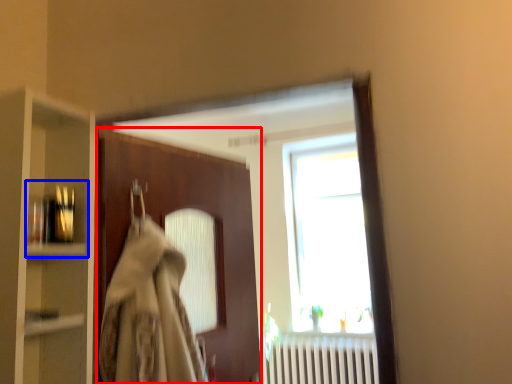
Question: Which point is further to the camera, door (highlighted by a red box) or shelf (highlighted by a blue box)?

Choices:
 (A) door
 (B) shelf

Answer: (A)